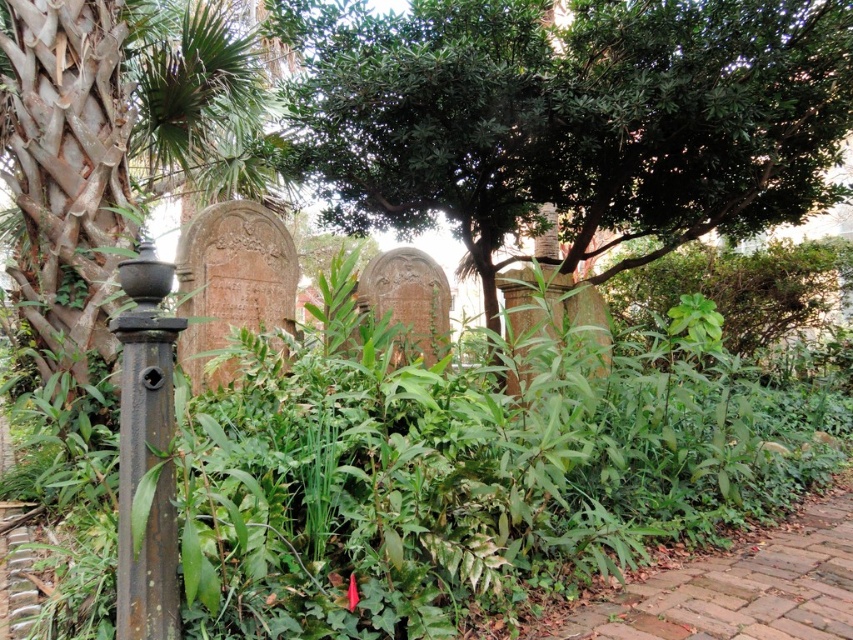
Question: Does green leafy tree at center appear on the right side of rusty metal pole at left?

Choices:
 (A) yes
 (B) no

Answer: (A)

Question: Is green leafy tree at center above brick at lower right?

Choices:
 (A) yes
 (B) no

Answer: (A)

Question: Which object is the farthest from the brick at lower right?

Choices:
 (A) rusty metal pole at left
 (B) green leafy tree at center

Answer: (B)

Question: Is brick at lower right behind rusty metal pole at left?

Choices:
 (A) no
 (B) yes

Answer: (B)

Question: Which object appears closest to the camera in this image?

Choices:
 (A) green leafy tree at center
 (B) brick at lower right

Answer: (B)

Question: Which point appears farthest from the camera in this image?

Choices:
 (A) (714, 193)
 (B) (184, 320)

Answer: (A)